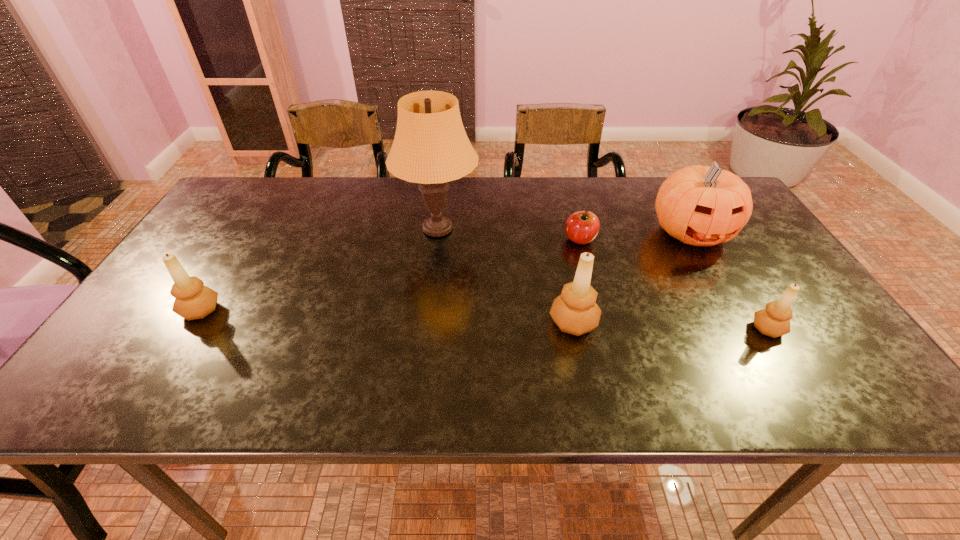
Where is `free space between the shortest object and the pumpkin`? The image size is (960, 540). free space between the shortest object and the pumpkin is located at coordinates (636, 236).

Where is `free space between the tallest candle_holder and the pumpkin`? This screenshot has height=540, width=960. free space between the tallest candle_holder and the pumpkin is located at coordinates (633, 278).

At what (x,y) coordinates should I click in order to perform the action: click on empty location between the leftmost object and the fifth tallest object. Please return your answer as a coordinate pair (x, y). Image resolution: width=960 pixels, height=540 pixels. Looking at the image, I should click on (484, 319).

In order to click on vacant area that lies between the shortest object and the tallest object in this screenshot , I will do `click(509, 234)`.

Identify the location of object identified as the third closest to the second candle_holder from right to left. This screenshot has height=540, width=960. (699, 205).

I want to click on the closest object to the second shortest object, so click(699, 205).

You are a GUI agent. You are given a task and a screenshot of the screen. Output one action in this format:
    pyautogui.click(x=<x>, y=<y>)
    Task: Click on the second closest candle_holder relative to the tallest object
    
    Given the screenshot: What is the action you would take?
    pyautogui.click(x=193, y=300)

In order to click on the third closest candle_holder relative to the lampshade in this screenshot , I will do `click(774, 321)`.

At what (x,y) coordinates should I click in order to perform the action: click on free spot that satisfies the following two spatial constraints: 1. on the front-facing side of the pumpkin; 2. on the right side of the rightmost candle_holder. Please return your answer as a coordinate pair (x, y). The image size is (960, 540). Looking at the image, I should click on (746, 329).

Where is `vacant area in the image that satisfies the following two spatial constraints: 1. on the front side of the second candle_holder from left to right; 2. on the right side of the shortest candle_holder`? This screenshot has width=960, height=540. vacant area in the image that satisfies the following two spatial constraints: 1. on the front side of the second candle_holder from left to right; 2. on the right side of the shortest candle_holder is located at coordinates (575, 329).